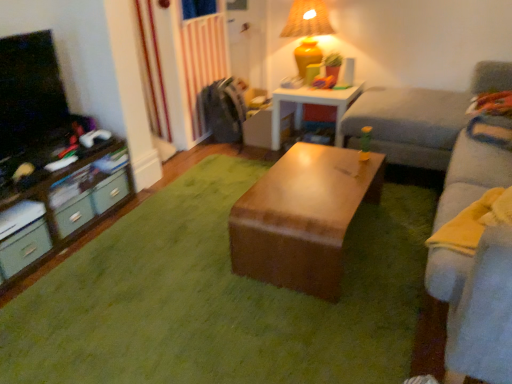
This screenshot has height=384, width=512. I want to click on empty space that is ontop of green soft carpet at center (from a real-world perspective), so click(228, 284).